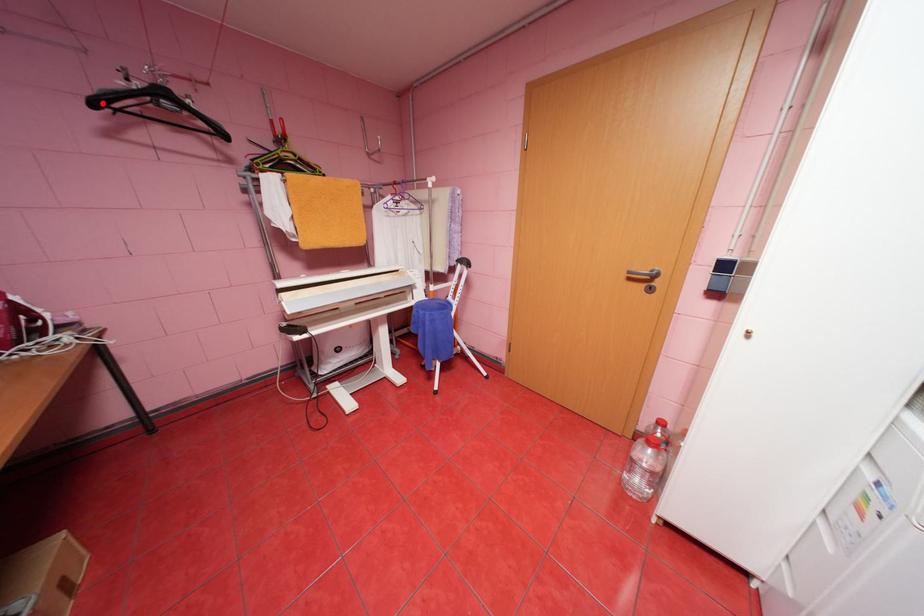
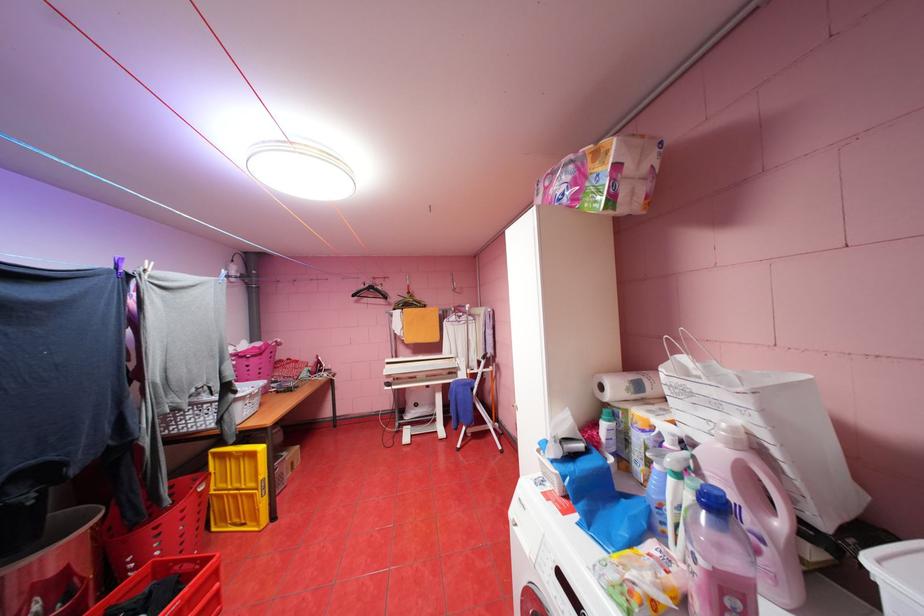
The point at the highlighted location is marked in the first image. Where is the corresponding point in the second image?

(361, 294)